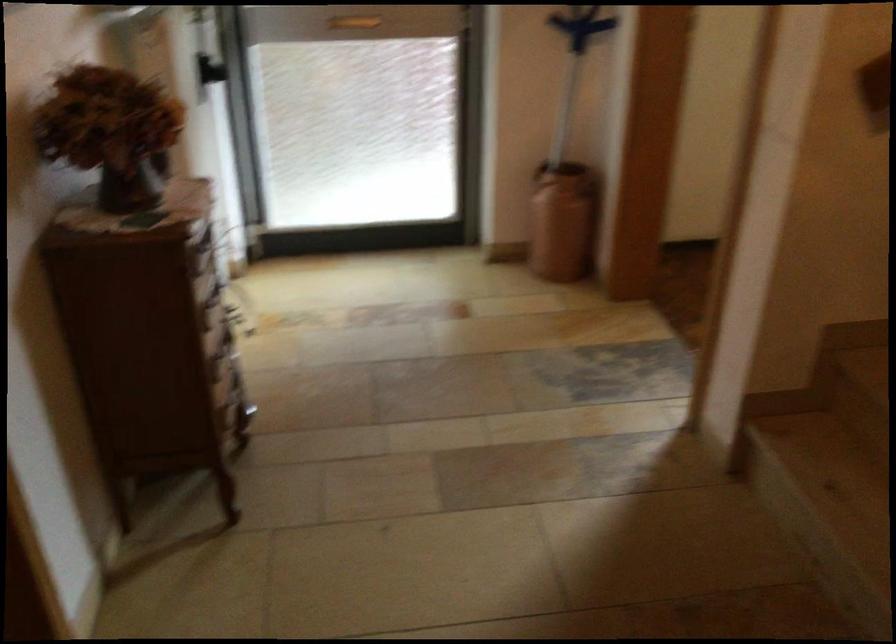
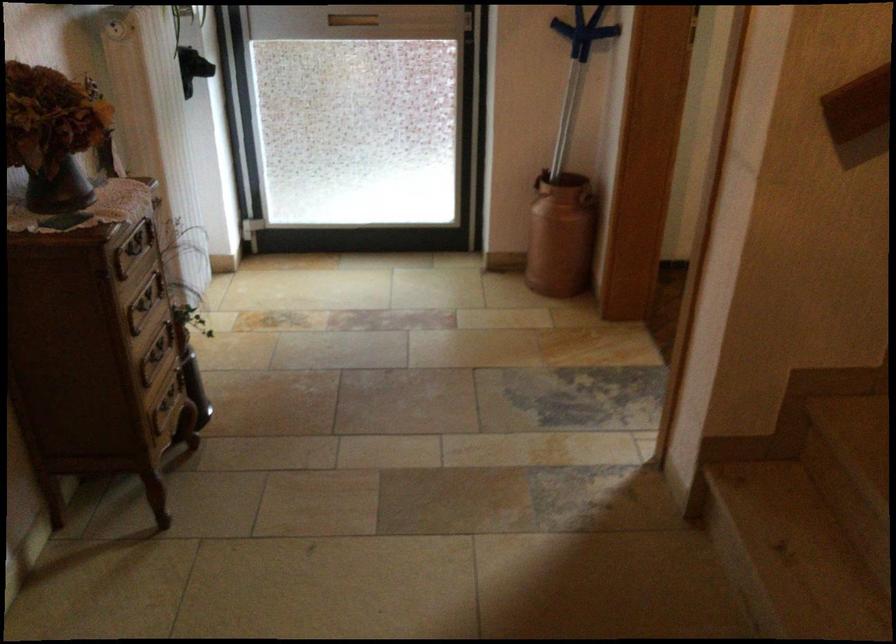
The point at (222, 350) is marked in the first image. Where is the corresponding point in the second image?

(156, 355)